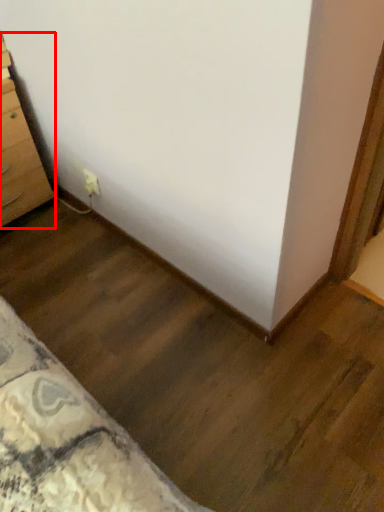
Question: Considering the relative positions of chest of drawers (annotated by the red box) and electric outlet in the image provided, where is chest of drawers (annotated by the red box) located with respect to the staircase?

Choices:
 (A) left
 (B) right

Answer: (A)